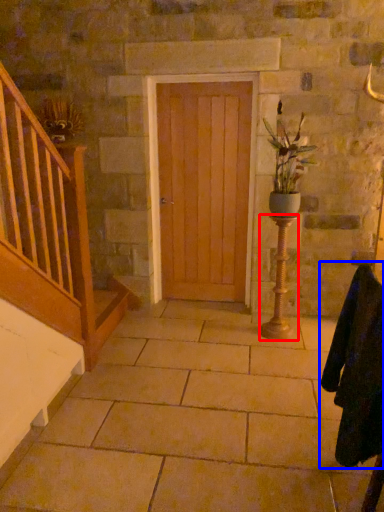
Question: Which object appears closest to the camera in this image, candle holder (highlighted by a red box) or robe (highlighted by a blue box)?

Choices:
 (A) candle holder
 (B) robe

Answer: (B)